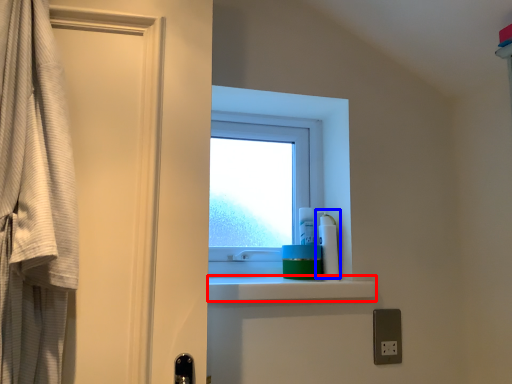
Question: Which object is further to the camera taking this photo, balustrade (highlighted by a red box) or cleaning product (highlighted by a blue box)?

Choices:
 (A) balustrade
 (B) cleaning product

Answer: (B)